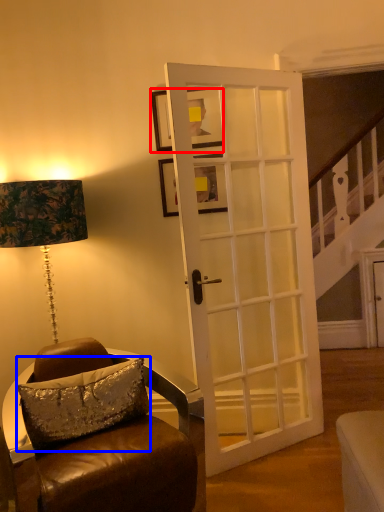
Question: Which object is closer to the camera taking this photo, picture frame (highlighted by a red box) or pillow (highlighted by a blue box)?

Choices:
 (A) picture frame
 (B) pillow

Answer: (B)